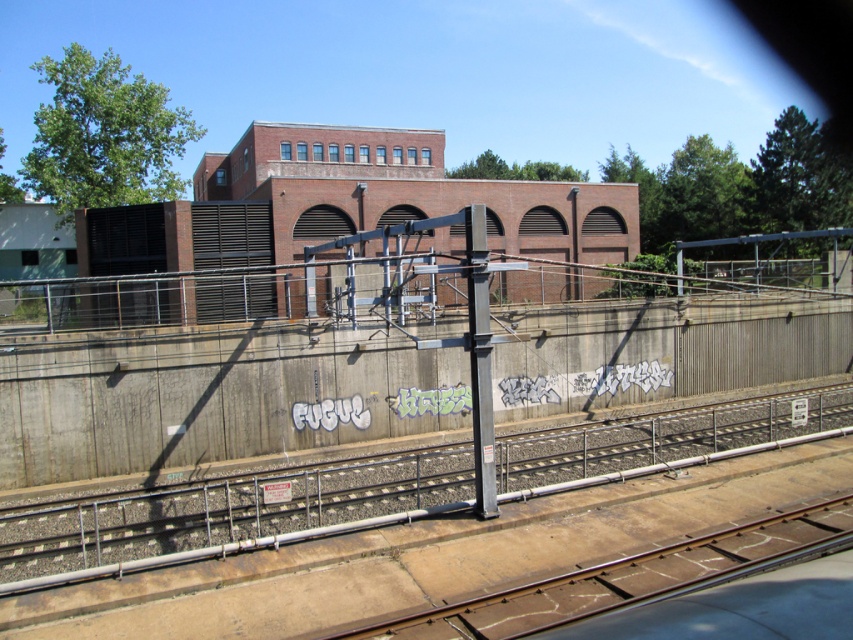
Question: Which point is farther from the camera taking this photo?

Choices:
 (A) (544, 589)
 (B) (6, 548)

Answer: (B)

Question: From the image, what is the correct spatial relationship of concrete train track at center in relation to brown metal train track at lower center?

Choices:
 (A) below
 (B) above

Answer: (B)

Question: Does concrete train track at center appear on the right side of brown metal train track at lower center?

Choices:
 (A) no
 (B) yes

Answer: (B)

Question: Can you confirm if concrete train track at center is thinner than brown metal train track at lower center?

Choices:
 (A) yes
 (B) no

Answer: (B)